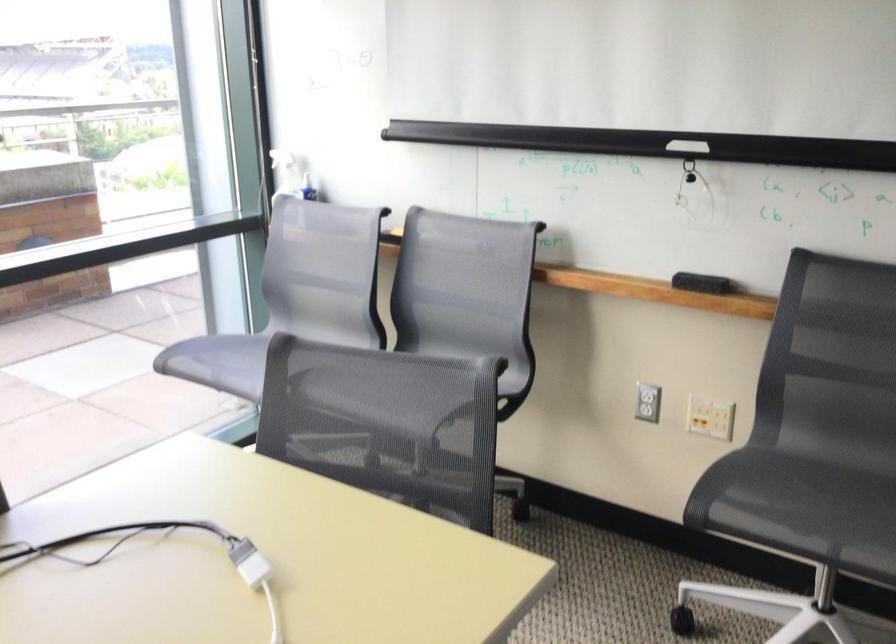
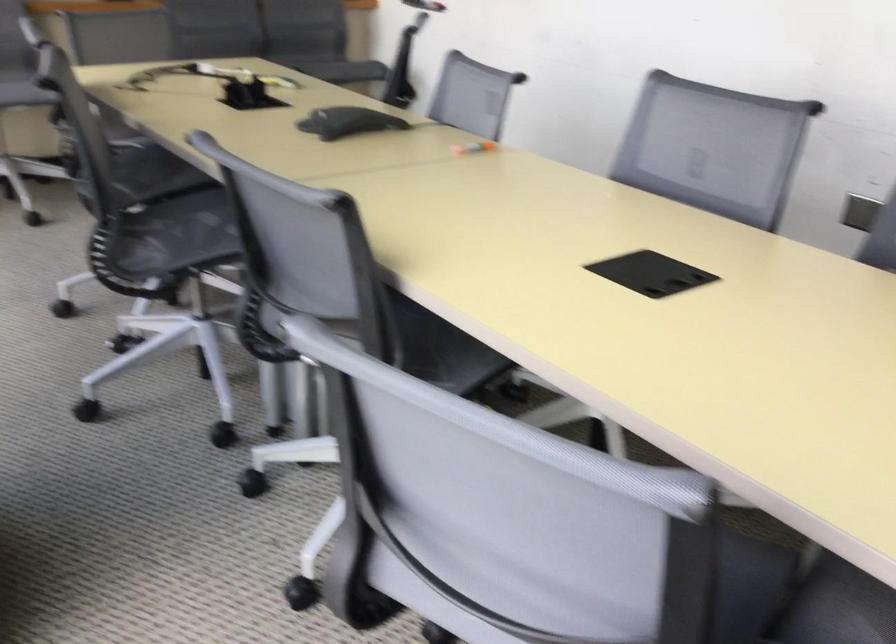
Question: I am providing you with two images of the same scene from different viewpoints. After the viewpoint changes to image2, which objects are now occluded?

Choices:
 (A) black marker pen
 (B) gray chair armrest
 (C) orange marker
 (D) grey mesh chair sitting surface

Answer: (D)